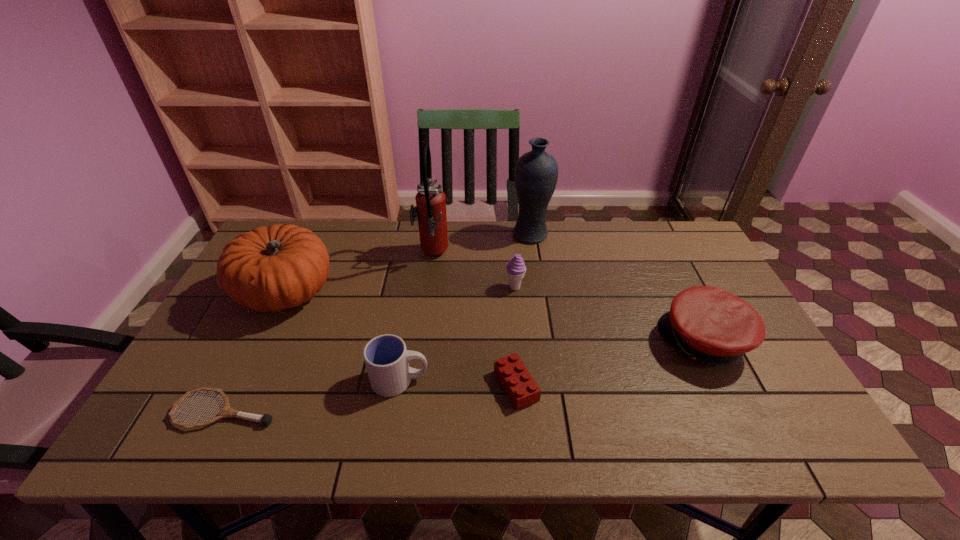
This screenshot has height=540, width=960. In order to click on pumpkin at the far edge in this screenshot , I will do `click(273, 268)`.

I want to click on object that is at the near edge, so click(266, 419).

Locate an element on the screen. pumpkin that is at the left edge is located at coordinates (273, 268).

The width and height of the screenshot is (960, 540). I want to click on tennis racket that is at the left edge, so pos(266,419).

The width and height of the screenshot is (960, 540). Identify the location of object that is at the right edge. (709, 324).

At what (x,y) coordinates should I click in order to perform the action: click on object at the far left corner. Please return your answer as a coordinate pair (x, y). Looking at the image, I should click on (273, 268).

I want to click on object at the near left corner, so click(x=266, y=419).

The height and width of the screenshot is (540, 960). I want to click on free point at the far edge, so click(x=393, y=239).

What are the coordinates of `vacant region at the near edge` in the screenshot? It's located at (329, 415).

Where is `free region at the left edge`? free region at the left edge is located at coordinates (218, 327).